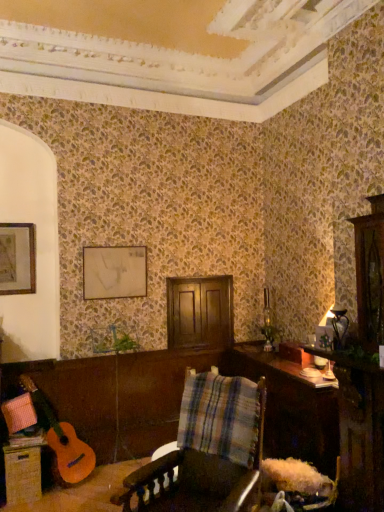
Question: In the image, is woven wicker drawer at lower left positioned in front of or behind plaid fabric at center?

Choices:
 (A) front
 (B) behind

Answer: (B)

Question: Is woven wicker drawer at lower left inside the boundaries of plaid fabric at center, or outside?

Choices:
 (A) outside
 (B) inside

Answer: (A)

Question: Considering the real-world distances, which object is farthest from the plaid fabric at center?

Choices:
 (A) wooden table at lower right
 (B) matte white picture frame at upper center, the 2th picture frame when ordered from left to right
 (C) woven wicker drawer at lower left
 (D) matte gold picture frame at upper left, arranged as the 1th picture frame when viewed from the front
 (E) wooden plaid chair at center

Answer: (D)

Question: Which object is the closest to the wooden table at lower right?

Choices:
 (A) matte gold picture frame at upper left, arranged as the 1th picture frame when viewed from the front
 (B) wooden plaid chair at center
 (C) woven wicker drawer at lower left
 (D) plaid fabric at center
 (E) matte white picture frame at upper center, the 1th picture frame from the right

Answer: (D)